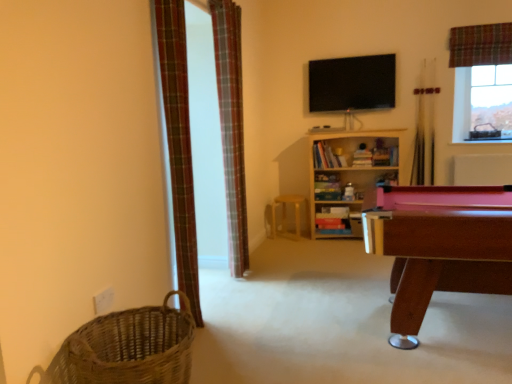
Question: Does plaid fabric curtain at upper right, marked as the first curtain in a right-to-left arrangement, have a larger size compared to plaid fabric curtain at center, the second curtain when ordered from front to back?

Choices:
 (A) no
 (B) yes

Answer: (A)

Question: From a real-world perspective, is plaid fabric curtain at upper right, which appears as the 1th curtain when viewed from the back, beneath plaid fabric curtain at center, marked as the second curtain in a back-to-front arrangement?

Choices:
 (A) yes
 (B) no

Answer: (B)

Question: Can you confirm if plaid fabric curtain at upper right, placed as the 3th curtain when sorted from front to back, is positioned to the left of plaid fabric curtain at center, the second curtain when ordered from front to back?

Choices:
 (A) yes
 (B) no

Answer: (B)

Question: Is plaid fabric curtain at upper right, placed as the 3th curtain when sorted from front to back, far from plaid fabric curtain at center, the second curtain when ordered from front to back?

Choices:
 (A) no
 (B) yes

Answer: (B)

Question: Is plaid fabric curtain at upper right, placed as the 3th curtain when sorted from front to back, turned away from plaid fabric curtain at center, marked as the second curtain in a back-to-front arrangement?

Choices:
 (A) no
 (B) yes

Answer: (A)

Question: Is plaid fabric curtain at upper right, marked as the first curtain in a right-to-left arrangement, taller than plaid fabric curtain at center, positioned as the 2th curtain in right-to-left order?

Choices:
 (A) yes
 (B) no

Answer: (B)

Question: Considering the relative sizes of plaid fabric curtain at upper right, which appears as the 1th curtain when viewed from the back, and wooden stool at center in the image provided, is plaid fabric curtain at upper right, which appears as the 1th curtain when viewed from the back, bigger than wooden stool at center?

Choices:
 (A) no
 (B) yes

Answer: (A)

Question: From a real-world perspective, is plaid fabric curtain at upper right, marked as the first curtain in a right-to-left arrangement, located higher than wooden stool at center?

Choices:
 (A) yes
 (B) no

Answer: (A)

Question: From the image's perspective, is plaid fabric curtain at upper right, which appears as the 1th curtain when viewed from the back, on wooden stool at center?

Choices:
 (A) no
 (B) yes

Answer: (B)

Question: Can you confirm if plaid fabric curtain at upper right, which appears as the 1th curtain when viewed from the back, is shorter than wooden stool at center?

Choices:
 (A) yes
 (B) no

Answer: (B)

Question: From a real-world perspective, is plaid fabric curtain at upper right, marked as the first curtain in a right-to-left arrangement, positioned under wooden stool at center based on gravity?

Choices:
 (A) yes
 (B) no

Answer: (B)

Question: Is plaid fabric curtain at upper right, marked as the first curtain in a right-to-left arrangement, in front of wooden stool at center?

Choices:
 (A) no
 (B) yes

Answer: (B)

Question: Is plaid fabric curtain at left, acting as the third curtain starting from the right, further to camera compared to wooden pool table at right?

Choices:
 (A) yes
 (B) no

Answer: (A)